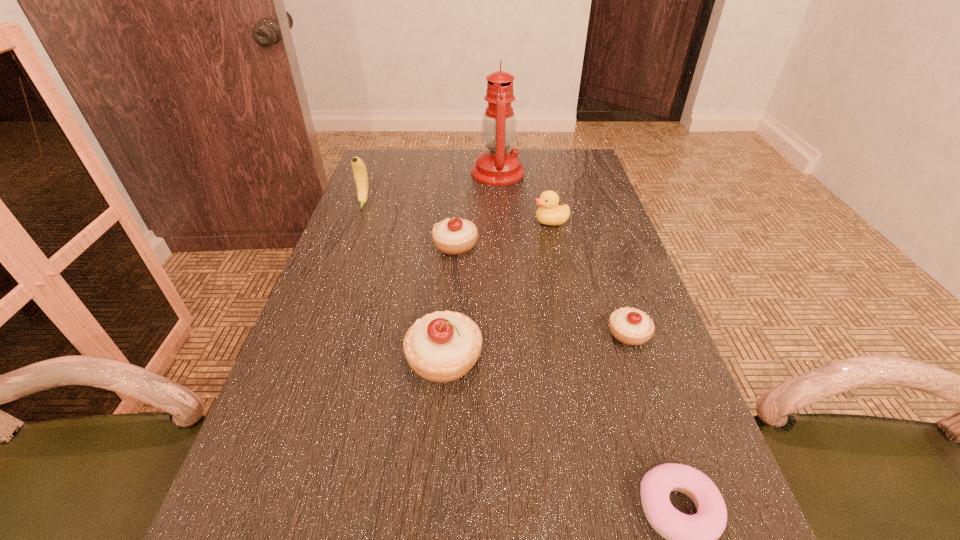
You are a GUI agent. You are given a task and a screenshot of the screen. Output one action in this format:
    pyautogui.click(x=<x>, y=<y>)
    Task: Click on the free space between the farthest pastry and the duckling
    The width and height of the screenshot is (960, 540).
    Given the screenshot: What is the action you would take?
    pyautogui.click(x=503, y=233)

The width and height of the screenshot is (960, 540). What are the coordinates of `free spot between the leftmost object and the third farthest object` in the screenshot? It's located at (457, 212).

Find the location of `unoccupied area between the smallest beige pastry and the biggest beige pastry`. unoccupied area between the smallest beige pastry and the biggest beige pastry is located at coordinates (537, 346).

Locate an element on the screen. vacant area that lies between the yellow duckling and the banana is located at coordinates (457, 212).

This screenshot has width=960, height=540. Find the location of `vacant area between the yellow duckling and the third shortest pastry`. vacant area between the yellow duckling and the third shortest pastry is located at coordinates (503, 233).

Point out which object is positioned as the nearest to the biggest beige pastry. Please provide its 2D coordinates. Your answer should be formatted as a tuple, i.e. [(x, y)], where the tuple contains the x and y coordinates of a point satisfying the conditions above.

[(455, 236)]

Select which object is the sixth closest to the farthest beige pastry. Please provide its 2D coordinates. Your answer should be formatted as a tuple, i.e. [(x, y)], where the tuple contains the x and y coordinates of a point satisfying the conditions above.

[(691, 539)]

Select which pastry appears as the second closest to the yellow duckling. Please provide its 2D coordinates. Your answer should be formatted as a tuple, i.e. [(x, y)], where the tuple contains the x and y coordinates of a point satisfying the conditions above.

[(630, 326)]

Find the location of `pastry that is the fourth closest to the leftmost object`. pastry that is the fourth closest to the leftmost object is located at coordinates (691, 539).

Identify the location of the second closest beige pastry to the fifth nearest object. (630, 326).